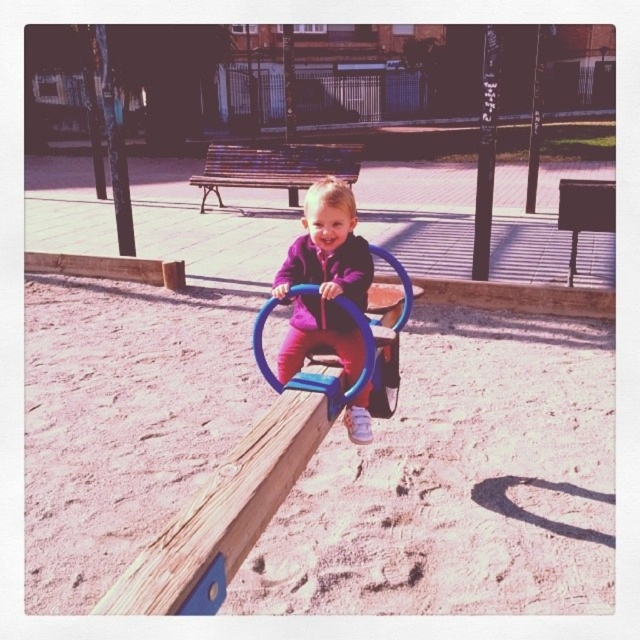
Question: Does smooth sand at center have a smaller size compared to purple fleece jacket at center?

Choices:
 (A) yes
 (B) no

Answer: (B)

Question: Is purple fleece jacket at center below blue plastic swing at center?

Choices:
 (A) no
 (B) yes

Answer: (A)

Question: Can you confirm if purple fleece jacket at center is positioned below blue plastic swing at center?

Choices:
 (A) no
 (B) yes

Answer: (A)

Question: Which of these objects is positioned farthest from the purple fleece jacket at center?

Choices:
 (A) blue plastic swing at center
 (B) smooth sand at center

Answer: (B)

Question: Among these points, which one is farthest from the camera?

Choices:
 (A) (291, 262)
 (B) (77, 419)

Answer: (B)

Question: Which is nearer to the purple fleece jacket at center?

Choices:
 (A) blue plastic swing at center
 (B) smooth sand at center

Answer: (A)